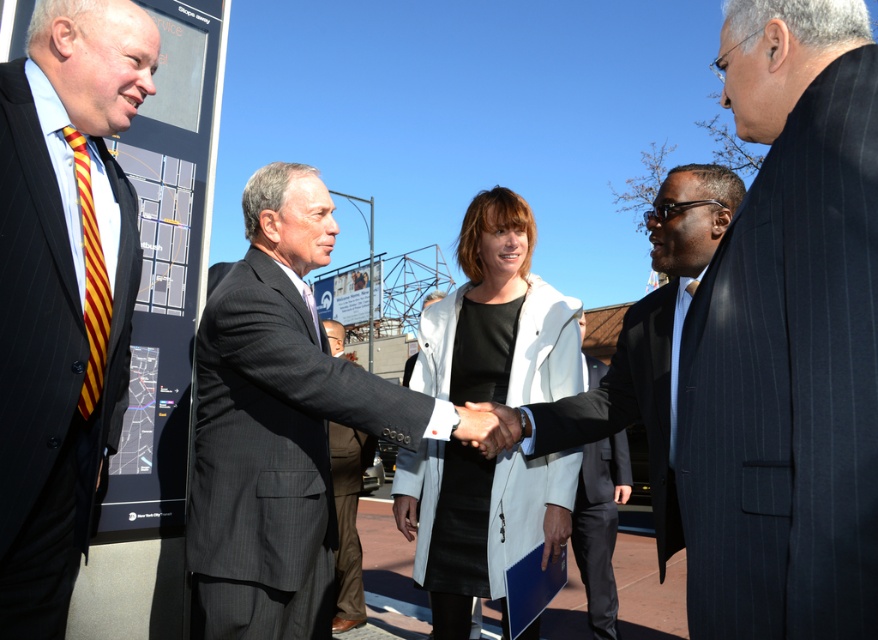
You are an event photographer at the scene. You need to capture a photo where the white matte coat at center and the dark brown suit at center are both clearly visible. Based on their positions, which one should you focus on first to ensure both are in frame?

The white matte coat at center is located above the dark brown suit at center, so focusing on the white matte coat at center first will ensure both are within the frame as the dark brown suit at center is below it.

Looking at this image, you are a photographer positioned at the bottom of the image. You want to capture a closeup shot of the white matte coat at center without including the large map board on the left. Based on the coat and map board positions, can you position yourself to do this?

The white matte coat at center is located at point (499, 316), so yes, you can position yourself to capture the coat without the map board by framing the shot to exclude the left side where the map board is located.